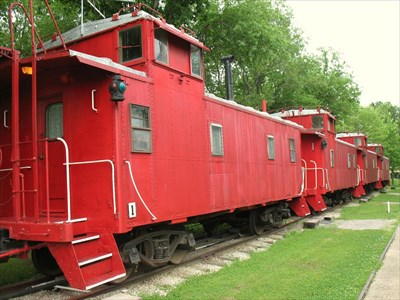
This screenshot has height=300, width=400. Find the location of `window`. window is located at coordinates (217, 143).